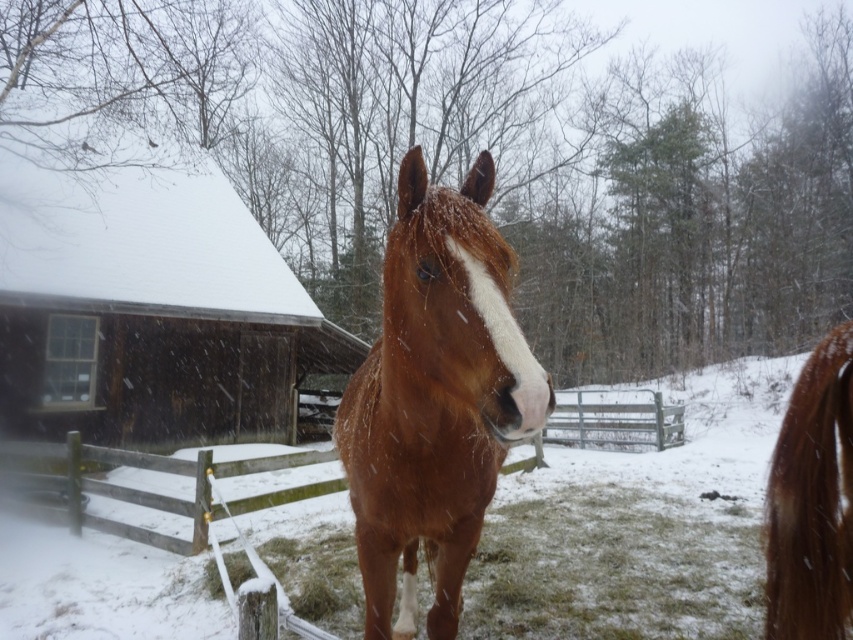
Looking at this image, you are a photographer standing in the snow. You want to take a closeup photo of the brown glossy horse at center. The camera you have requires you to be at least 1.8 meters away from the subject to avoid blurry photos. Can you take the photo from your current position?

The brown glossy horse at center and viewer are 1.73 meters apart from each other. Since the required distance is 1.8 meters, you are too close to take a clear photo without blurriness.

You are a photographer trying to capture the perfect shot of the brown glossy horse at center. You want to position your camera exactly at the center of the image. Given the horse is located at point 0.623, 0.511, will your camera need to be moved to the left or right to center the horse?

The brown glossy horse at center is positioned at coordinates (434, 397). Since the x coordinate is 0.623, which is to the right of the center point 0.5, you need to move the camera to the right to center the horse.